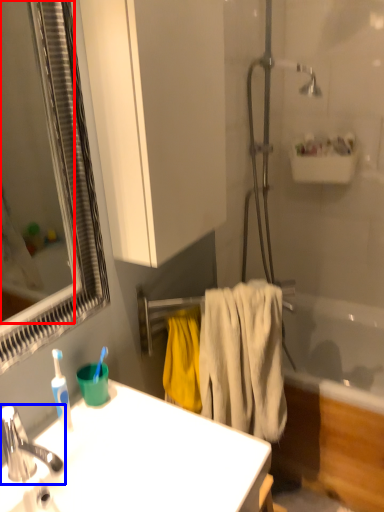
Question: Which point is closer to the camera, mirror (highlighted by a red box) or tap (highlighted by a blue box)?

Choices:
 (A) mirror
 (B) tap

Answer: (A)